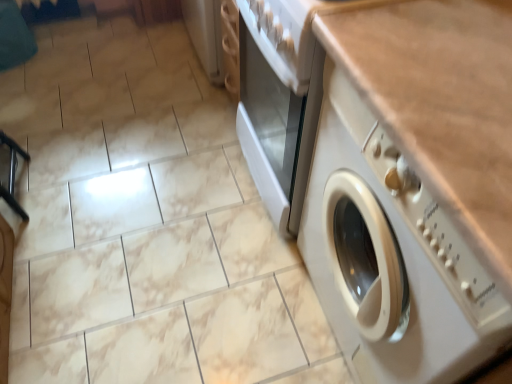
Question: In terms of size, does white plastic washing machine at center appear bigger or smaller than white glossy gas stove at upper center?

Choices:
 (A) big
 (B) small

Answer: (A)

Question: From a real-world perspective, is white plastic washing machine at center above or below white glossy gas stove at upper center?

Choices:
 (A) above
 (B) below

Answer: (B)

Question: Considering the positions of white plastic washing machine at center and white glossy gas stove at upper center in the image, is white plastic washing machine at center wider or thinner than white glossy gas stove at upper center?

Choices:
 (A) thin
 (B) wide

Answer: (B)

Question: Is point (295, 89) positioned closer to the camera than point (336, 223)?

Choices:
 (A) closer
 (B) farther

Answer: (A)

Question: Is white glossy gas stove at upper center inside the boundaries of white plastic washing machine at center, or outside?

Choices:
 (A) inside
 (B) outside

Answer: (B)

Question: Would you say white glossy gas stove at upper center is to the left or to the right of white plastic washing machine at center in the picture?

Choices:
 (A) left
 (B) right

Answer: (A)

Question: From their relative heights in the image, would you say white glossy gas stove at upper center is taller or shorter than white plastic washing machine at center?

Choices:
 (A) tall
 (B) short

Answer: (B)